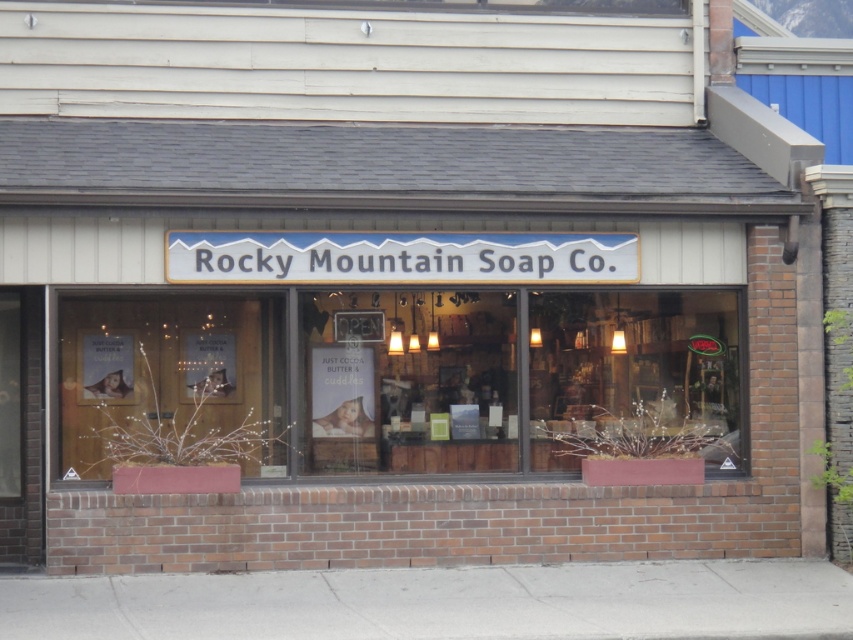
Locate an element on the screen. translucent glass window at center is located at coordinates (633, 376).

Is translucent glass window at center to the left of clear glass window at lower left from the viewer's perspective?

No, translucent glass window at center is not to the left of clear glass window at lower left.

Between point (698, 314) and point (4, 380), which one is positioned in front?

Point (4, 380)

At what (x,y) coordinates should I click in order to perform the action: click on translucent glass window at center. Please return your answer as a coordinate pair (x, y). The height and width of the screenshot is (640, 853). Looking at the image, I should click on (633, 376).

Measure the distance between white plastic sign at center and clear glass window at lower left.

They are 8.71 feet apart.

Can you confirm if white plastic sign at center is positioned to the left of clear glass window at lower left?

Incorrect, white plastic sign at center is not on the left side of clear glass window at lower left.

Which is behind, point (370, 253) or point (16, 458)?

Positioned behind is point (16, 458).

Where is `white plastic sign at center`? The image size is (853, 640). white plastic sign at center is located at coordinates (399, 257).

At what (x,y) coordinates should I click in order to perform the action: click on wooden display case at center. Please return your answer as a coordinate pair (x, y). The width and height of the screenshot is (853, 640). Looking at the image, I should click on (399, 380).

Between wooden display case at center and wooden door at center, which one is positioned lower?

wooden display case at center

Measure the distance between wooden display case at center and camera.

wooden display case at center is 13.29 meters away from camera.

The height and width of the screenshot is (640, 853). Identify the location of wooden display case at center. (399, 380).